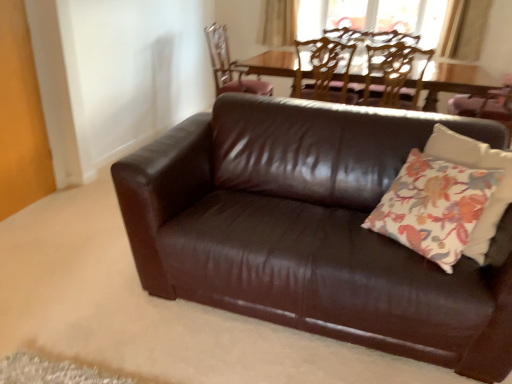
Question: In terms of width, does beige fabric curtain at upper center look wider or thinner when compared to wooden textured chair at upper center, the 1th chair when ordered from right to left?

Choices:
 (A) thin
 (B) wide

Answer: (A)

Question: From the image's perspective, is beige fabric curtain at upper center positioned above or below wooden textured chair at upper center, the 3th chair viewed from the left?

Choices:
 (A) above
 (B) below

Answer: (A)

Question: Which of these objects is positioned farthest from the floral fabric pillow at center?

Choices:
 (A) wooden chair at upper center, the 3th chair from the right
 (B) beige fabric curtain at upper center
 (C) brown leather chair at upper center, marked as the second chair in a left-to-right arrangement
 (D) brown leather couch at center
 (E) wooden textured chair at upper center, the 3th chair viewed from the left

Answer: (B)

Question: Estimate the real-world distances between objects in this image. Which object is closer to the floral fabric pillow at center?

Choices:
 (A) beige fabric curtain at upper center
 (B) wooden chair at upper center, the 3th chair from the right
 (C) wooden textured chair at upper center, the 3th chair viewed from the left
 (D) brown leather chair at upper center, the 2th chair viewed from the right
 (E) brown leather couch at center

Answer: (E)